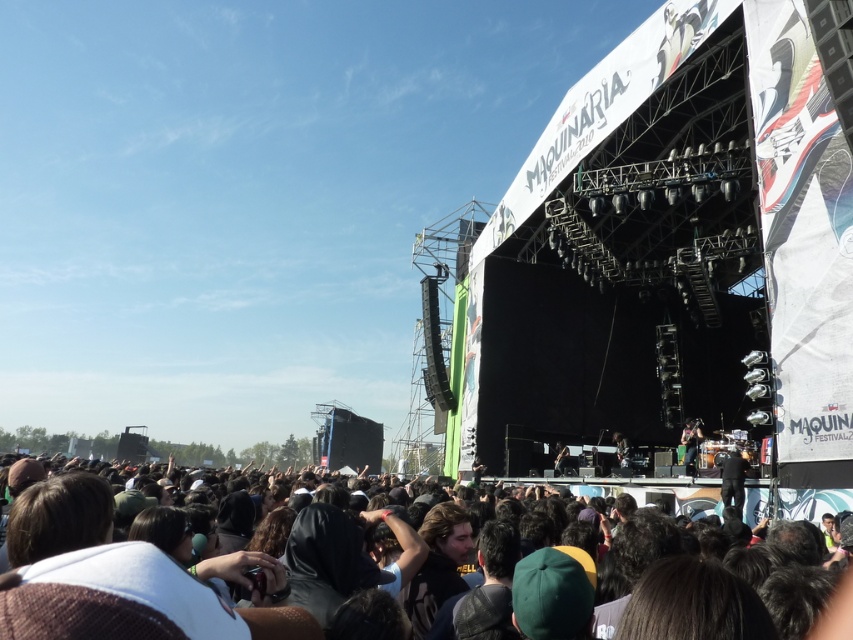
Can you confirm if dark brown hair at lower center is thinner than shiny black guitar at center?

No, dark brown hair at lower center is not thinner than shiny black guitar at center.

Between point (93, 618) and point (682, 433), which one is positioned in front?

Point (93, 618) is more forward.

Locate an element on the screen. The image size is (853, 640). dark brown hair at lower center is located at coordinates (77, 614).

Where is `dark brown hair at lower center`? dark brown hair at lower center is located at coordinates (77, 614).